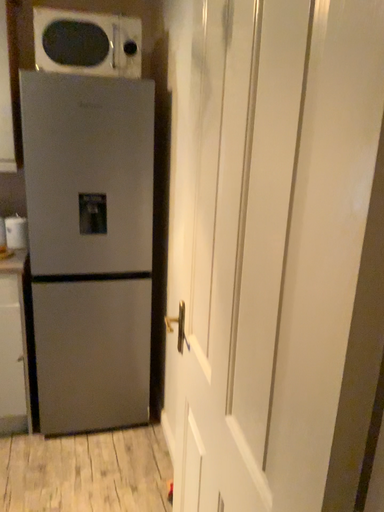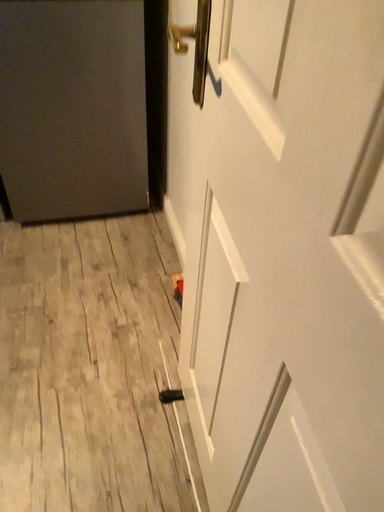
Question: How did the camera likely rotate when shooting the video?

Choices:
 (A) rotated upward
 (B) rotated downward

Answer: (B)